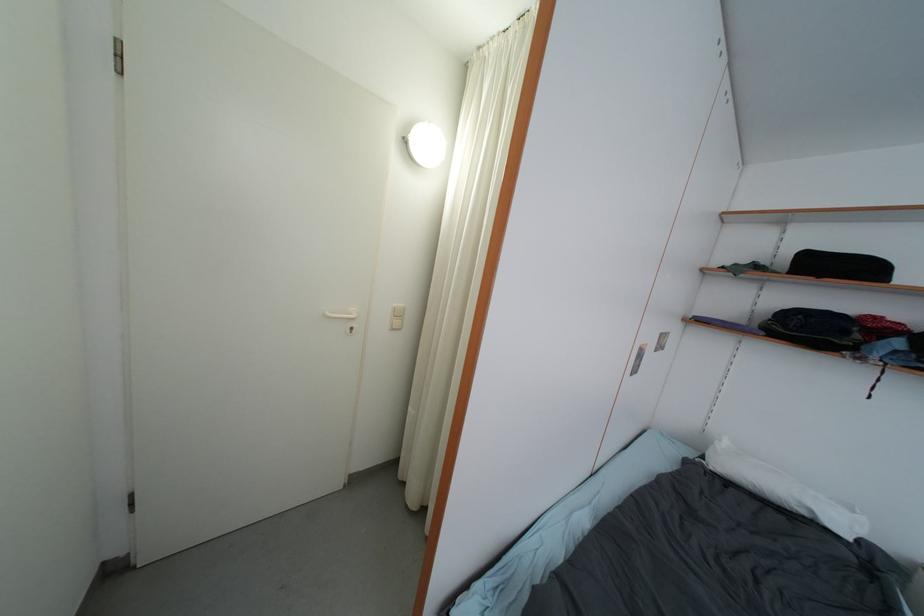
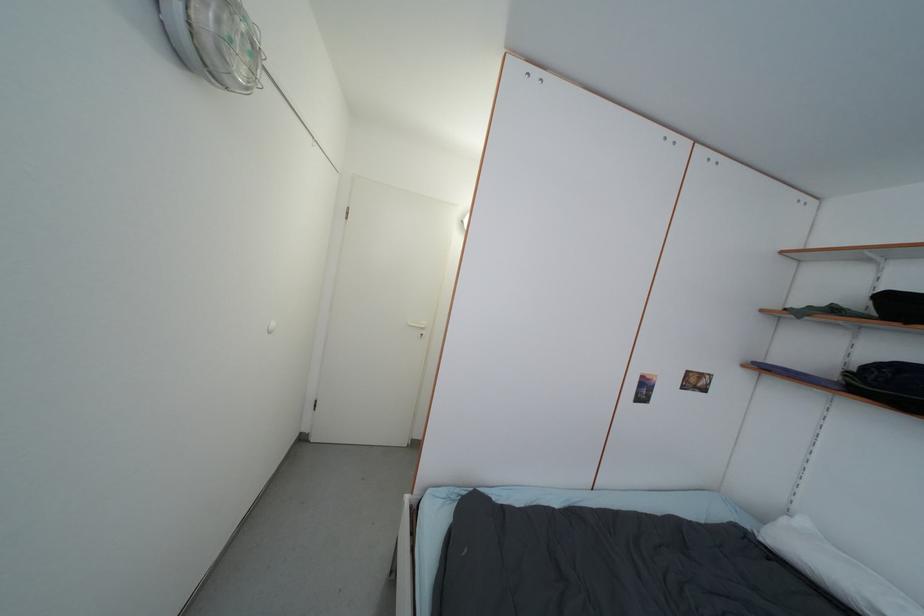
Find the pixel in the second image that matches (810,334) in the first image.

(906, 392)